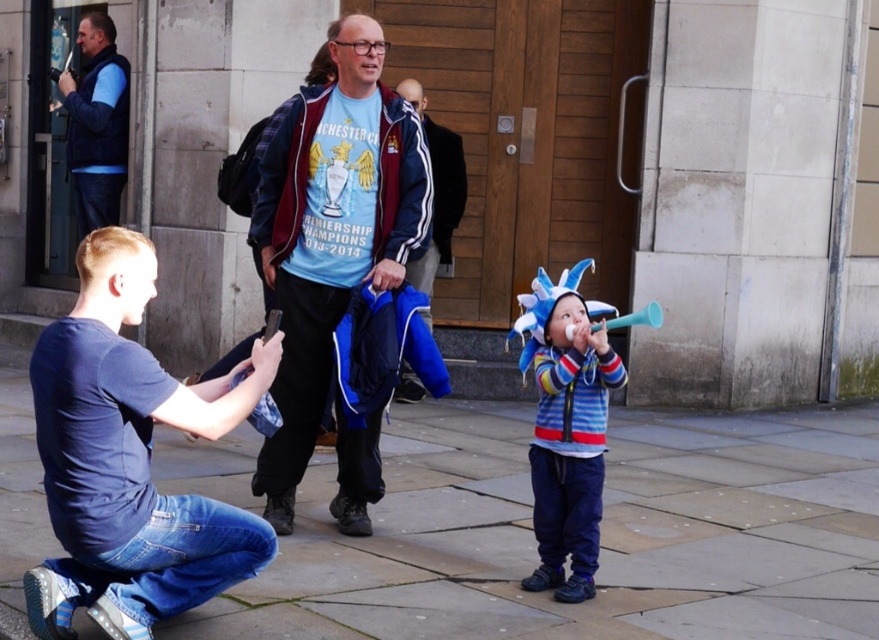
Question: Where is slate gray paving stone at center located in relation to blue fleece vest at left in the image?

Choices:
 (A) below
 (B) above

Answer: (A)

Question: Which object appears farthest from the camera in this image?

Choices:
 (A) blue fleece vest at left
 (B) blue denim jeans at lower left
 (C) slate gray paving stone at center

Answer: (A)

Question: Does blue fleece vest at left appear under blue fleece jacket at center?

Choices:
 (A) yes
 (B) no

Answer: (B)

Question: Can you confirm if blue fabric jacket at center is wider than blue fleece vest at left?

Choices:
 (A) no
 (B) yes

Answer: (B)

Question: Based on their relative distances, which object is nearer to the striped fleece at center?

Choices:
 (A) blue denim jeans at lower left
 (B) blue fabric jacket at center

Answer: (B)

Question: Estimate the real-world distances between objects in this image. Which object is farther from the slate gray paving stone at center?

Choices:
 (A) striped fleece at center
 (B) blue denim jeans at lower left
 (C) blue fleece vest at left
 (D) blue fleece jacket at center

Answer: (C)